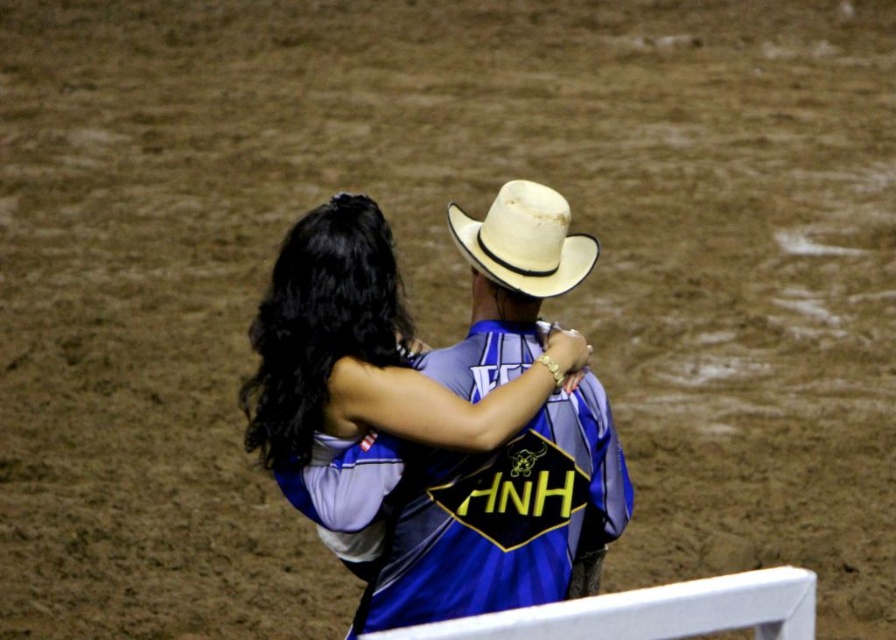
Question: Does matte blue jersey at center appear under white straw cowboy hat at upper center?

Choices:
 (A) no
 (B) yes

Answer: (B)

Question: Is matte blue jersey at center below white straw cowboy hat at upper center?

Choices:
 (A) no
 (B) yes

Answer: (B)

Question: Which point is farther from the camera taking this photo?

Choices:
 (A) (514, 268)
 (B) (342, 352)

Answer: (A)

Question: Which point is farther to the camera?

Choices:
 (A) matte blue jersey at center
 (B) white straw cowboy hat at upper center

Answer: (B)

Question: Is matte blue jersey at center wider than white straw cowboy hat at upper center?

Choices:
 (A) yes
 (B) no

Answer: (A)